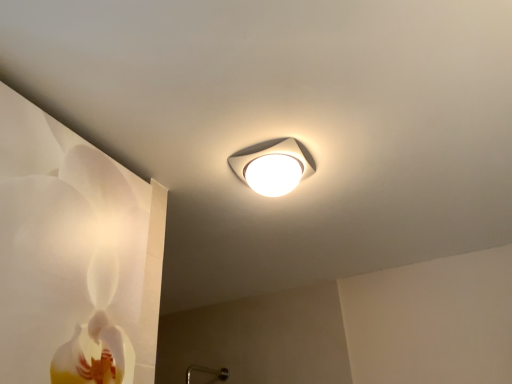
Measure the distance between white glossy lamp at upper center and camera.

white glossy lamp at upper center is 3.99 feet from camera.

This screenshot has width=512, height=384. I want to click on white glossy lamp at upper center, so click(x=273, y=166).

This screenshot has height=384, width=512. What do you see at coordinates (273, 166) in the screenshot?
I see `white glossy lamp at upper center` at bounding box center [273, 166].

Find the location of a particular element. The width and height of the screenshot is (512, 384). white glossy lamp at upper center is located at coordinates (273, 166).